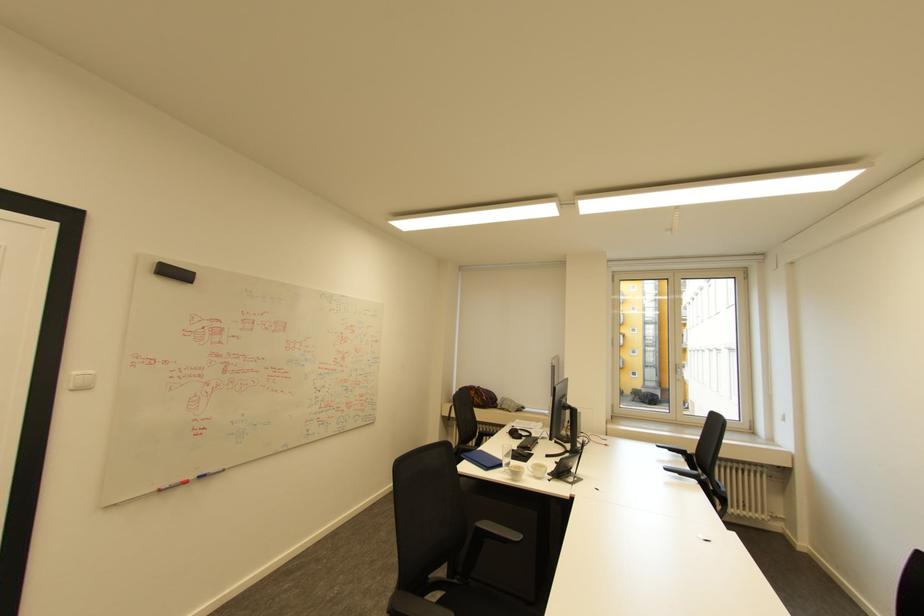
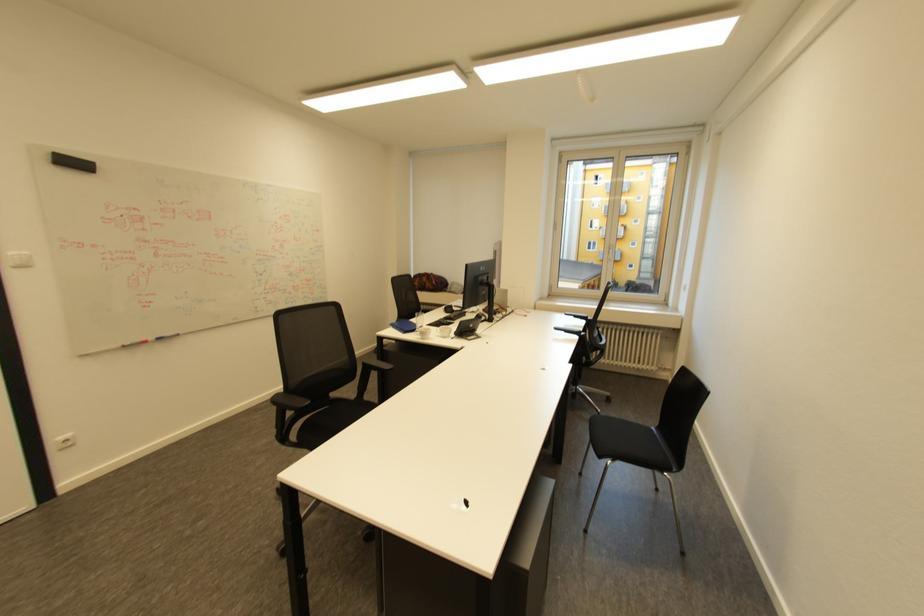
Where in the second image is the point corresponding to [539,474] from the first image?

(446, 334)